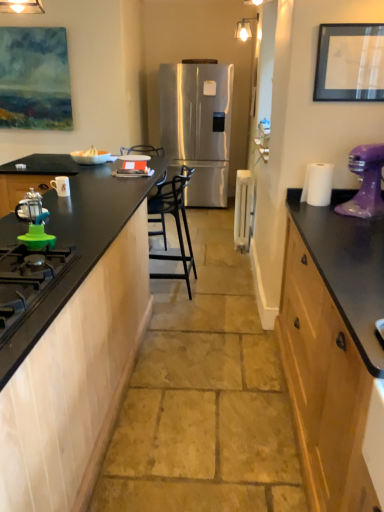
Question: Is green rubber gas stove at lower left positioned far away from white ceramic mug at left, placed as the 3th appliance when sorted from back to front?

Choices:
 (A) no
 (B) yes

Answer: (B)

Question: Is green rubber gas stove at lower left smaller than white ceramic mug at left, the 4th appliance from the right?

Choices:
 (A) yes
 (B) no

Answer: (B)

Question: Is green rubber gas stove at lower left at the left side of white ceramic mug at left, the third appliance when ordered from front to back?

Choices:
 (A) no
 (B) yes

Answer: (A)

Question: Is green rubber gas stove at lower left placed right next to white ceramic mug at left, the third appliance when ordered from front to back?

Choices:
 (A) no
 (B) yes

Answer: (A)

Question: From a real-world perspective, does green rubber gas stove at lower left stand above white ceramic mug at left, placed as the 3th appliance when sorted from back to front?

Choices:
 (A) yes
 (B) no

Answer: (B)

Question: From a real-world perspective, is green rubber gas stove at lower left positioned under white ceramic mug at left, positioned as the 2th appliance in left-to-right order, based on gravity?

Choices:
 (A) yes
 (B) no

Answer: (A)

Question: From the image's perspective, is black metal chair at center located beneath green rubber gas stove at lower left?

Choices:
 (A) no
 (B) yes

Answer: (A)

Question: Considering the relative sizes of black metal chair at center and green rubber gas stove at lower left in the image provided, is black metal chair at center taller than green rubber gas stove at lower left?

Choices:
 (A) yes
 (B) no

Answer: (A)

Question: Does black metal chair at center have a larger size compared to green rubber gas stove at lower left?

Choices:
 (A) no
 (B) yes

Answer: (B)

Question: Does black metal chair at center appear on the left side of green rubber gas stove at lower left?

Choices:
 (A) yes
 (B) no

Answer: (B)

Question: Can you confirm if black metal chair at center is wider than green rubber gas stove at lower left?

Choices:
 (A) no
 (B) yes

Answer: (B)

Question: Is black metal chair at center further to the viewer compared to green rubber gas stove at lower left?

Choices:
 (A) yes
 (B) no

Answer: (A)

Question: From a real-world perspective, is green plastic lid at lower left, arranged as the first appliance when viewed from the front, below white plastic radiator at center, the fifth appliance positioned from the left?

Choices:
 (A) no
 (B) yes

Answer: (A)